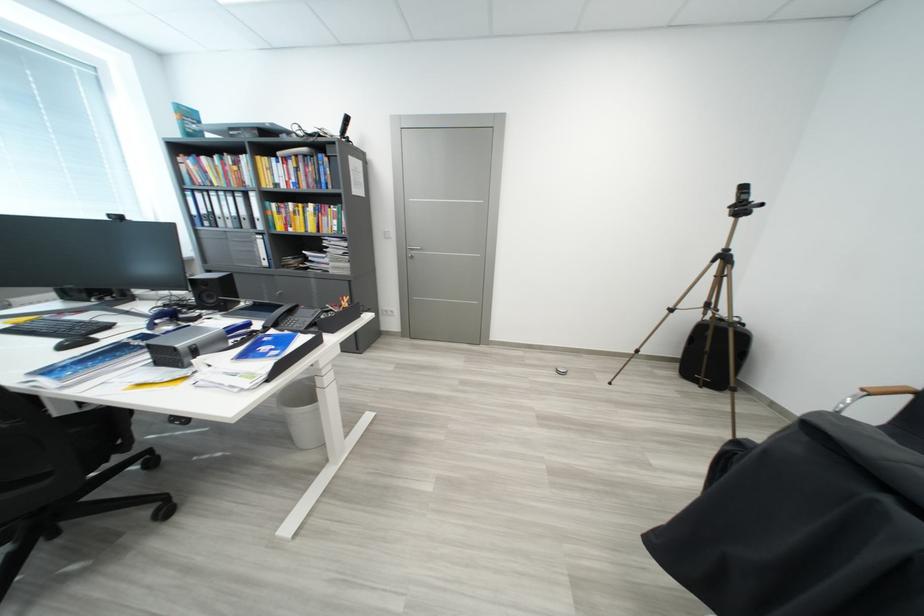
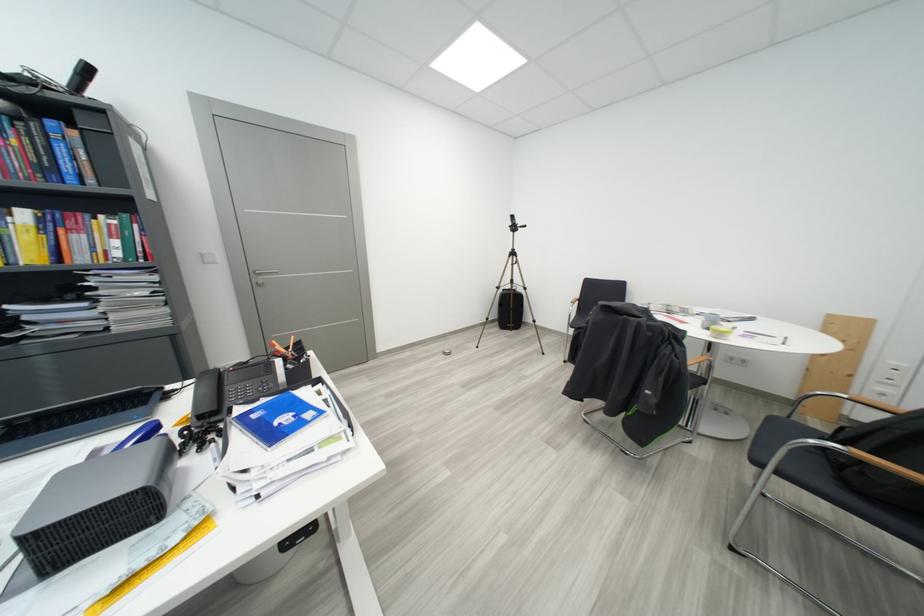
Where in the second image is the point corresponding to [344,225] from the first image?

(126, 245)